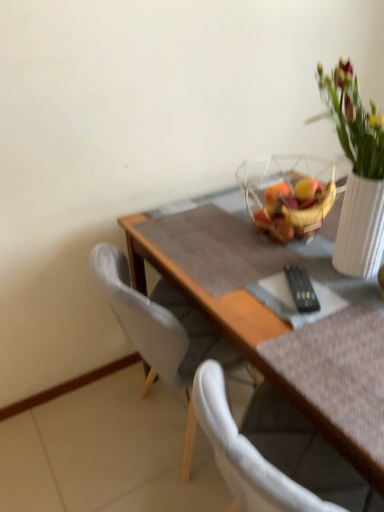
What are the coordinates of `free space above wooden table at center (from a real-world perspective)` in the screenshot? It's located at (278, 267).